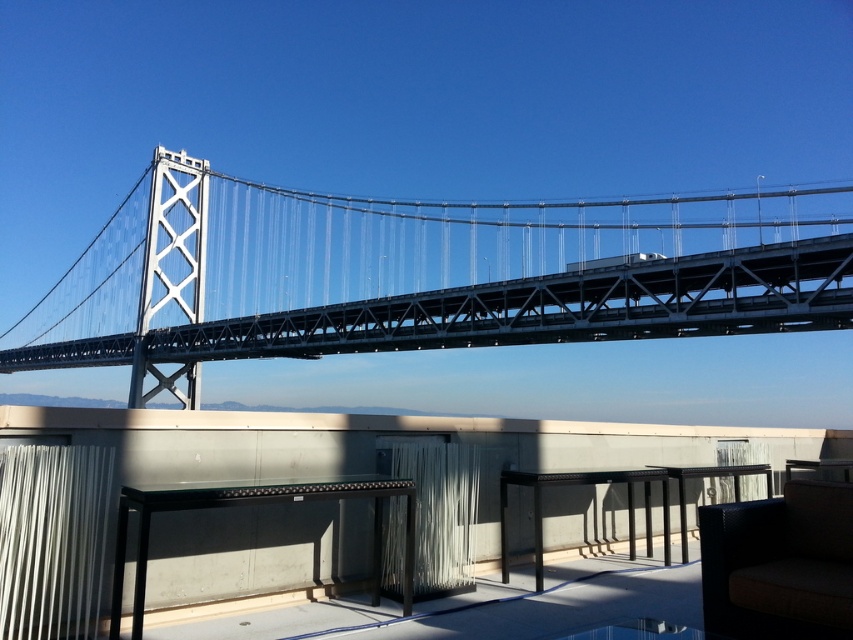
What do you see at coordinates (637, 630) in the screenshot? This screenshot has height=640, width=853. I see `transparent glass table at lower center` at bounding box center [637, 630].

Between point (575, 632) and point (735, 477), which one is positioned behind?

Point (735, 477)

The height and width of the screenshot is (640, 853). I want to click on transparent glass table at lower center, so click(637, 630).

Between metallic gray suspension bridge at upper center and black glass table at center, which one appears on the left side from the viewer's perspective?

metallic gray suspension bridge at upper center is more to the left.

Does metallic gray suspension bridge at upper center appear on the left side of black glass table at center?

Indeed, metallic gray suspension bridge at upper center is positioned on the left side of black glass table at center.

Between point (306, 244) and point (758, 470), which one is positioned behind?

Positioned behind is point (306, 244).

The height and width of the screenshot is (640, 853). In order to click on metallic gray suspension bridge at upper center in this screenshot , I will do `click(422, 275)`.

What do you see at coordinates (779, 564) in the screenshot?
I see `dark brown woven chair at lower right` at bounding box center [779, 564].

Which is behind, point (726, 577) or point (343, 499)?

Point (343, 499)

Locate an element on the screen. The width and height of the screenshot is (853, 640). dark brown woven chair at lower right is located at coordinates (779, 564).

Where is `dark brown woven chair at lower right`? The image size is (853, 640). dark brown woven chair at lower right is located at coordinates (779, 564).